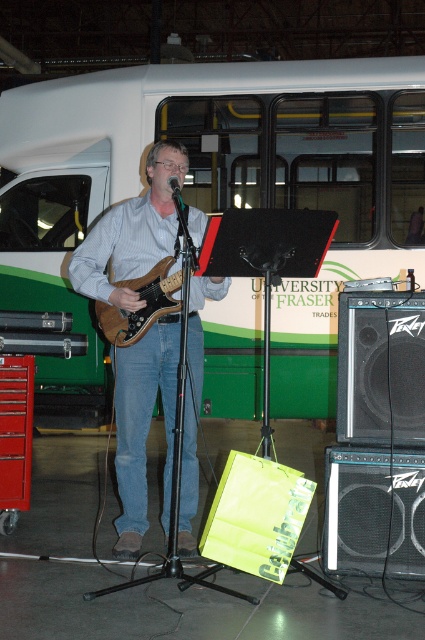
Question: Estimate the real-world distances between objects in this image. Which object is closer to the brown wood guitar at center?

Choices:
 (A) green matte bus at center
 (B) matte brown guitar at center
 (C) black matte microphone at center

Answer: (B)

Question: Does green matte bus at center appear over matte brown guitar at center?

Choices:
 (A) yes
 (B) no

Answer: (A)

Question: Estimate the real-world distances between objects in this image. Which object is closer to the green matte bus at center?

Choices:
 (A) matte brown guitar at center
 (B) brown wood guitar at center
 (C) black matte microphone at center

Answer: (A)

Question: Which of the following is the closest to the observer?

Choices:
 (A) (150, 198)
 (B) (125, 138)

Answer: (A)

Question: Does matte brown guitar at center have a greater width compared to brown wood guitar at center?

Choices:
 (A) yes
 (B) no

Answer: (A)

Question: Where is green matte bus at center located in relation to black matte microphone at center in the image?

Choices:
 (A) left
 (B) right

Answer: (B)